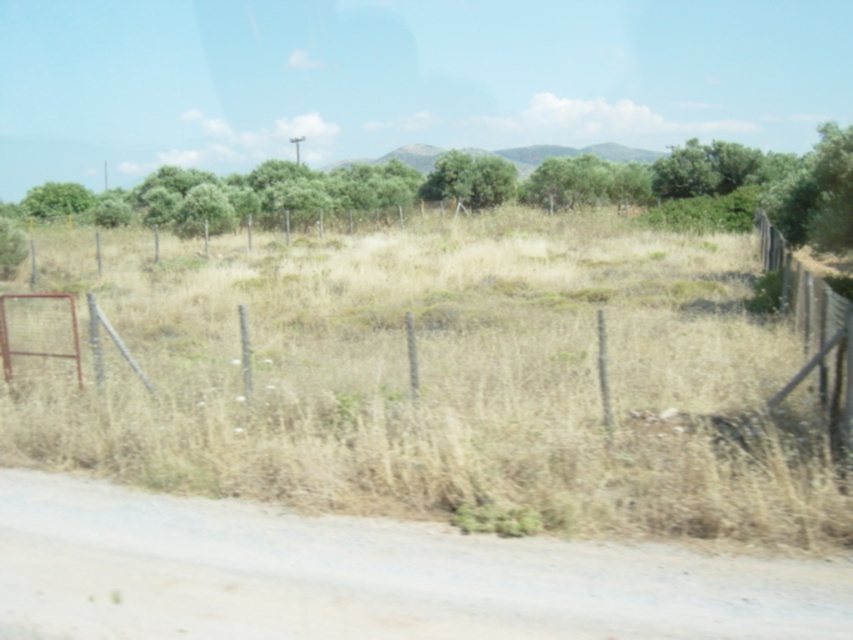
Between green leafy tree at upper center and wooden fence at right, which one has less height?

With less height is wooden fence at right.

Can you confirm if green leafy tree at upper center is wider than wooden fence at right?

Correct, the width of green leafy tree at upper center exceeds that of wooden fence at right.

Locate an element on the screen. The height and width of the screenshot is (640, 853). green leafy tree at upper center is located at coordinates (512, 188).

You are a GUI agent. You are given a task and a screenshot of the screen. Output one action in this format:
    pyautogui.click(x=<x>, y=<y>)
    Task: Click on the green leafy tree at upper center
    The height and width of the screenshot is (640, 853).
    Given the screenshot: What is the action you would take?
    pyautogui.click(x=512, y=188)

Does brown dirt track at lower left have a lesser width compared to wooden fence at right?

Indeed, brown dirt track at lower left has a lesser width compared to wooden fence at right.

Can you confirm if brown dirt track at lower left is wider than wooden fence at right?

Incorrect, brown dirt track at lower left's width does not surpass wooden fence at right's.

Describe the element at coordinates (367, 576) in the screenshot. I see `brown dirt track at lower left` at that location.

Identify the location of brown dirt track at lower left. (367, 576).

Who is shorter, green leafy tree at upper center or green leafy tree at center?

Standing shorter between the two is green leafy tree at center.

Which is more to the right, green leafy tree at upper center or green leafy tree at center?

green leafy tree at center is more to the right.

Describe the element at coordinates (512, 188) in the screenshot. I see `green leafy tree at upper center` at that location.

Find the location of a particular element. green leafy tree at upper center is located at coordinates (512, 188).